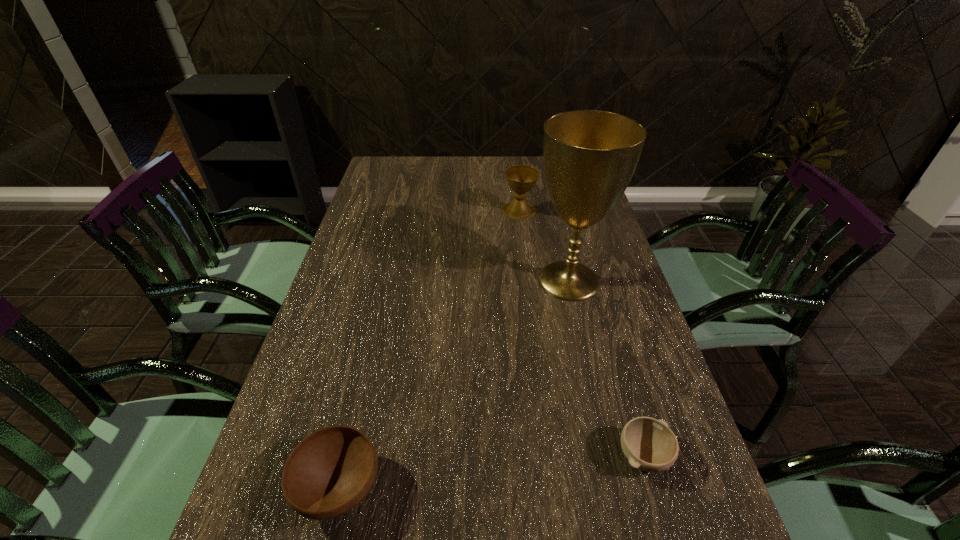
Find the location of a particular element. The height and width of the screenshot is (540, 960). the tallest object is located at coordinates (590, 156).

This screenshot has height=540, width=960. Find the location of `the second farthest object`. the second farthest object is located at coordinates (590, 156).

Where is `chalice`? chalice is located at coordinates (521, 178).

Locate an element on the screen. This screenshot has width=960, height=540. the second tallest object is located at coordinates (521, 178).

Locate an element on the screen. This screenshot has width=960, height=540. the second shortest object is located at coordinates (330, 471).

Where is `the taller bowl`? This screenshot has height=540, width=960. the taller bowl is located at coordinates (330, 471).

Where is `the shortest object`? The width and height of the screenshot is (960, 540). the shortest object is located at coordinates (649, 444).

You are a GUI agent. You are given a task and a screenshot of the screen. Output one action in this format:
    pyautogui.click(x=<x>, y=<y>)
    Task: Click on the shorter bowl
    This screenshot has width=960, height=540.
    Given the screenshot: What is the action you would take?
    (649, 444)

Where is `vacant space located 0.150m on the back of the trophy cup`? vacant space located 0.150m on the back of the trophy cup is located at coordinates (557, 228).

The height and width of the screenshot is (540, 960). In order to click on vacant space positioned on the right of the chalice in this screenshot , I will do `click(571, 211)`.